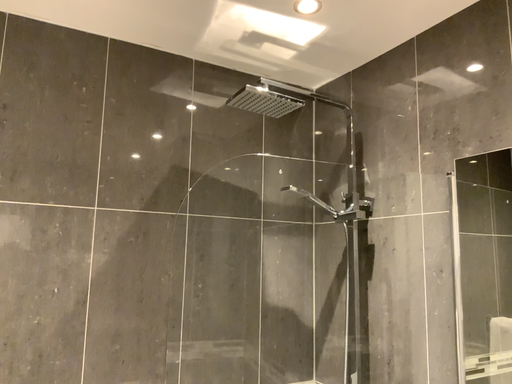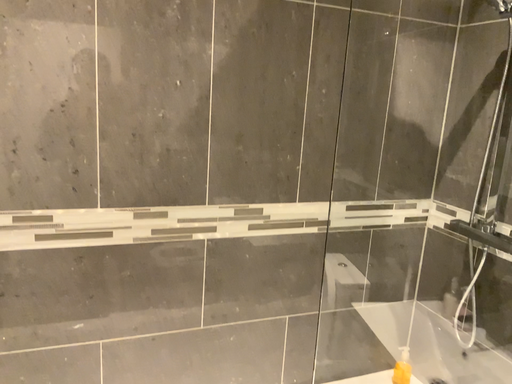
Question: Which way did the camera rotate in the video?

Choices:
 (A) rotated left
 (B) rotated right

Answer: (A)